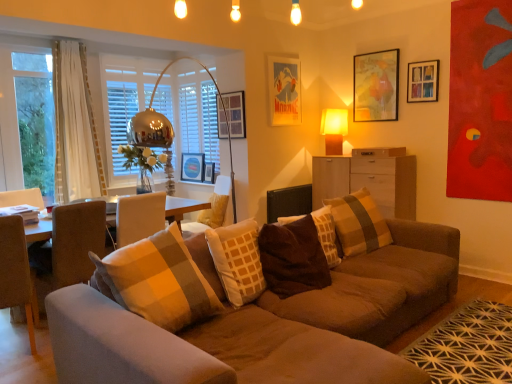
Question: Considering the relative sizes of wooden map at upper right, acting as the fifth picture frame starting from the left, and white wood drawer at center in the image provided, is wooden map at upper right, acting as the fifth picture frame starting from the left, shorter than white wood drawer at center?

Choices:
 (A) yes
 (B) no

Answer: (B)

Question: Is wooden map at upper right, acting as the fifth picture frame starting from the left, outside of white wood drawer at center?

Choices:
 (A) no
 (B) yes

Answer: (B)

Question: From the image's perspective, is wooden map at upper right, acting as the fifth picture frame starting from the left, on white wood drawer at center?

Choices:
 (A) yes
 (B) no

Answer: (A)

Question: Could you tell me if wooden map at upper right, acting as the fifth picture frame starting from the left, is facing white wood drawer at center?

Choices:
 (A) yes
 (B) no

Answer: (B)

Question: Does wooden map at upper right, acting as the fifth picture frame starting from the left, have a lesser width compared to white wood drawer at center?

Choices:
 (A) yes
 (B) no

Answer: (A)

Question: Does wooden map at upper right, acting as the fifth picture frame starting from the left, touch white wood drawer at center?

Choices:
 (A) yes
 (B) no

Answer: (B)

Question: Is beige fabric armchair at center turned away from white wood drawer at center?

Choices:
 (A) no
 (B) yes

Answer: (A)

Question: Is beige fabric armchair at center far away from white wood drawer at center?

Choices:
 (A) yes
 (B) no

Answer: (A)

Question: Is beige fabric armchair at center positioned before white wood drawer at center?

Choices:
 (A) no
 (B) yes

Answer: (A)

Question: Does beige fabric armchair at center appear on the left side of white wood drawer at center?

Choices:
 (A) no
 (B) yes

Answer: (B)

Question: Is white wood drawer at center completely or partially inside beige fabric armchair at center?

Choices:
 (A) no
 (B) yes

Answer: (A)

Question: Considering the relative sizes of beige fabric armchair at center and white wood drawer at center in the image provided, is beige fabric armchair at center bigger than white wood drawer at center?

Choices:
 (A) no
 (B) yes

Answer: (B)

Question: Considering the relative positions of white sheer curtain at left and white wood drawer at center in the image provided, is white sheer curtain at left in front of white wood drawer at center?

Choices:
 (A) no
 (B) yes

Answer: (B)